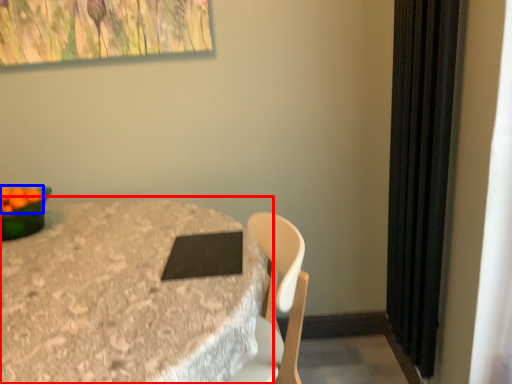
Question: Which of the following is the closest to the observer, table (highlighted by a red box) or fruit (highlighted by a blue box)?

Choices:
 (A) table
 (B) fruit

Answer: (A)